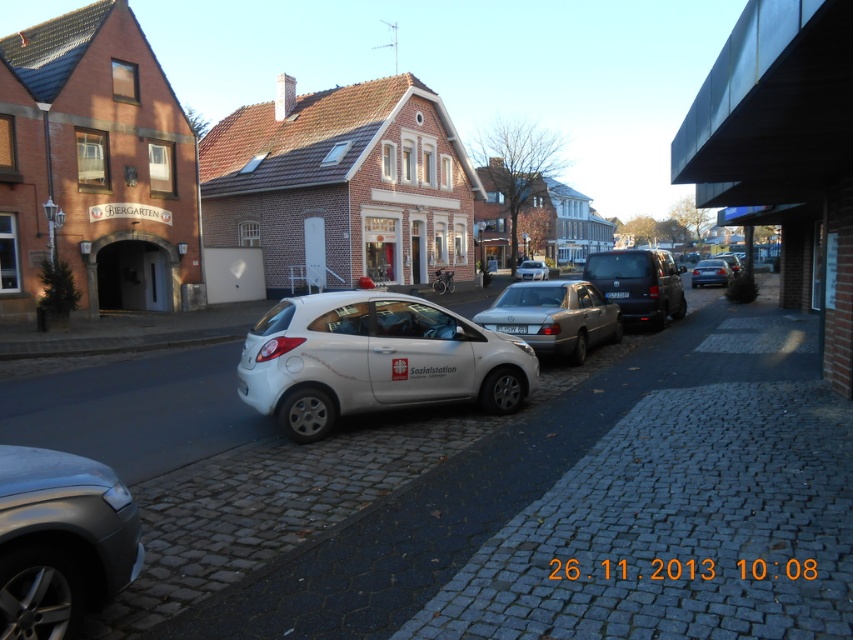
You are driving a silver metallic car at lower left and want to park it in a parking spot that can only accommodate vehicles up to the size of the silver metallic sedan at center. Can your car fit in the spot?

The silver metallic car at lower left is larger than the silver metallic sedan at center, so it cannot fit in the parking spot designed for the sedan.

You are standing at the entrance of the BIERGARTEN building and want to park your car. Is the silver metallic car at lower left blocking your view of the parking spot located at point 0.845, 0.072?

The silver metallic car at lower left is located exactly at point (61, 540), so it is occupying that parking spot and blocking your view.

In the scene shown: You are a pedestrian standing at the edge of the street. You see a silver metallic car at lower left and a shiny black van at center. Which vehicle is nearer to you?

The silver metallic car at lower left is closer to the viewer than the shiny black van at center, so the silver metallic car at lower left is nearer to you.